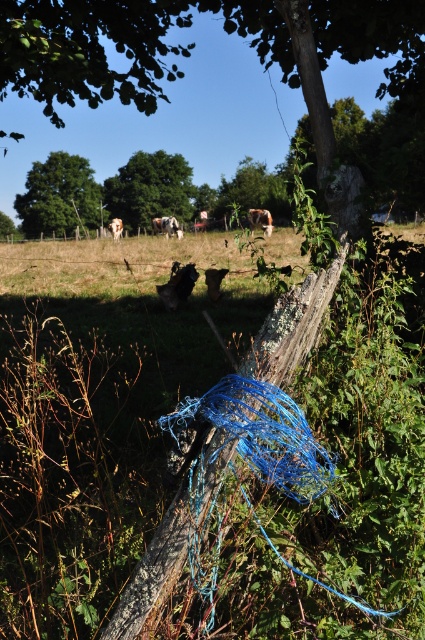
Is point (405, 13) farther from viewer compared to point (178, 234)?

No, (405, 13) is closer to viewer.

Describe the element at coordinates (192, 45) in the screenshot. I see `brown wood tree at center` at that location.

This screenshot has height=640, width=425. In order to click on brown wood tree at center in this screenshot , I will do `click(192, 45)`.

The image size is (425, 640). What do you see at coordinates (252, 189) in the screenshot?
I see `green rough bark tree at center` at bounding box center [252, 189].

Does green rough bark tree at center come in front of brown furry cow at center?

No, it is behind brown furry cow at center.

Between point (272, 179) and point (113, 227), which one is positioned in front?

Positioned in front is point (113, 227).

Find the location of `green rough bark tree at center`. green rough bark tree at center is located at coordinates pyautogui.click(x=252, y=189).

Is green leafy tree at center above white woolen sheep at center?

Correct, green leafy tree at center is located above white woolen sheep at center.

What are the coordinates of `green leafy tree at center` in the screenshot? It's located at (150, 188).

You are a GUI agent. You are given a task and a screenshot of the screen. Output one action in this format:
    pyautogui.click(x=<x>, y=<y>)
    Task: Click on the green leafy tree at center
    The image size is (425, 640).
    Given the screenshot: What is the action you would take?
    pyautogui.click(x=150, y=188)